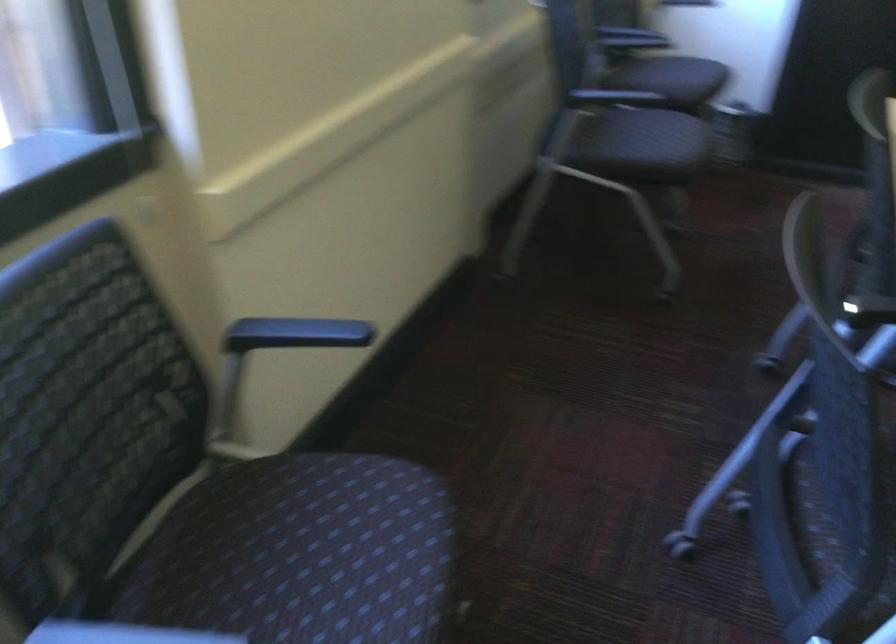
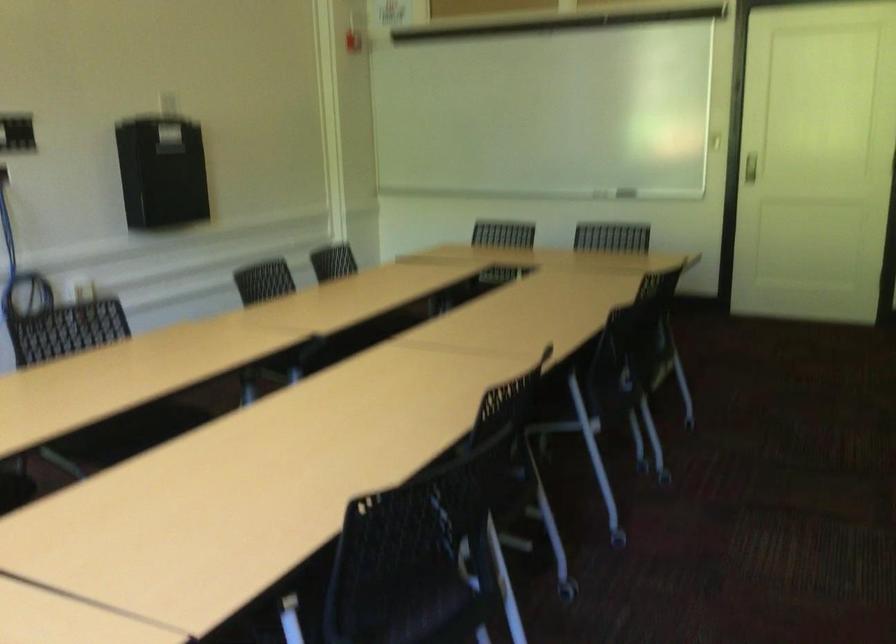
Question: The first image is from the beginning of the video and the second image is from the end. How did the camera likely rotate when shooting the video?

Choices:
 (A) Left
 (B) Right
 (C) Up
 (D) Down

Answer: (B)